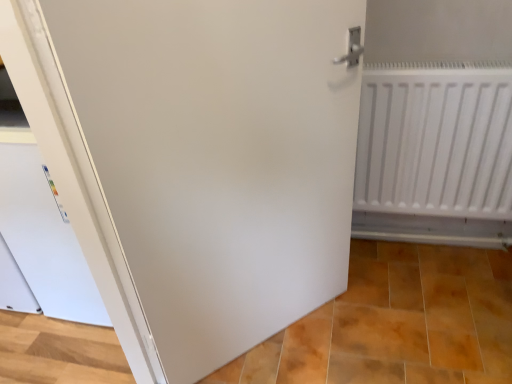
Question: Does white matte door at center have a smaller size compared to matte white tile at lower center?

Choices:
 (A) no
 (B) yes

Answer: (A)

Question: Can you confirm if white matte door at center is shorter than matte white tile at lower center?

Choices:
 (A) yes
 (B) no

Answer: (B)

Question: Could you tell me if white matte door at center is turned towards matte white tile at lower center?

Choices:
 (A) yes
 (B) no

Answer: (A)

Question: From a real-world perspective, is white matte door at center over matte white tile at lower center?

Choices:
 (A) no
 (B) yes

Answer: (B)

Question: Does white matte door at center have a lesser width compared to matte white tile at lower center?

Choices:
 (A) yes
 (B) no

Answer: (A)

Question: Is white matte door at center to the right of matte white tile at lower center from the viewer's perspective?

Choices:
 (A) no
 (B) yes

Answer: (A)

Question: Does matte white tile at lower center have a greater height compared to white matte radiator at right?

Choices:
 (A) no
 (B) yes

Answer: (A)

Question: Could you tell me if matte white tile at lower center is turned towards white matte radiator at right?

Choices:
 (A) yes
 (B) no

Answer: (B)

Question: From a real-world perspective, does matte white tile at lower center stand above white matte radiator at right?

Choices:
 (A) yes
 (B) no

Answer: (B)

Question: Can white matte radiator at right be found inside matte white tile at lower center?

Choices:
 (A) yes
 (B) no

Answer: (B)

Question: Is matte white tile at lower center thinner than white matte radiator at right?

Choices:
 (A) no
 (B) yes

Answer: (A)

Question: From a real-world perspective, is matte white tile at lower center physically below white matte radiator at right?

Choices:
 (A) no
 (B) yes

Answer: (B)

Question: Is white matte radiator at right smaller than matte white tile at lower center?

Choices:
 (A) yes
 (B) no

Answer: (A)